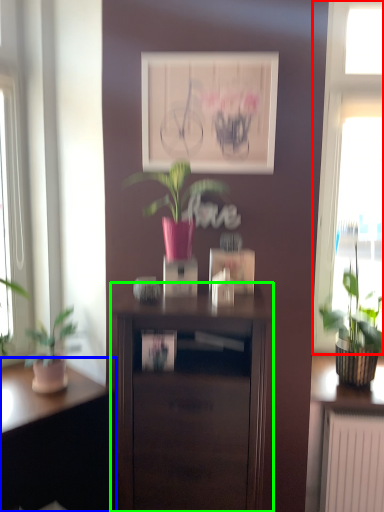
Question: Which object is the closest to the window (highlighted by a red box)? Choose among these: desk (highlighted by a blue box) or nightstand (highlighted by a green box).

Choices:
 (A) desk
 (B) nightstand

Answer: (B)